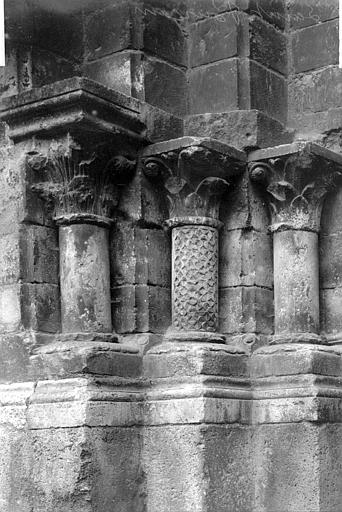
The width and height of the screenshot is (342, 512). In order to click on flat ledge in this screenshot , I will do `click(110, 93)`.